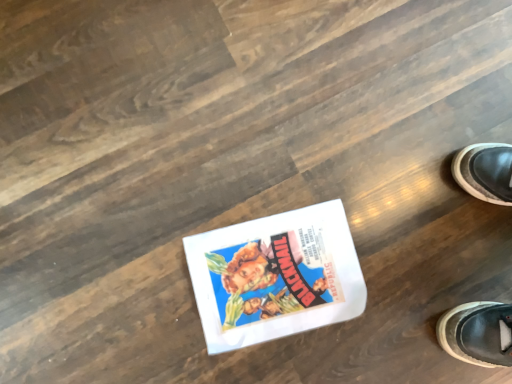
Find the location of `free spot behind matte paper book at center`. free spot behind matte paper book at center is located at coordinates (327, 165).